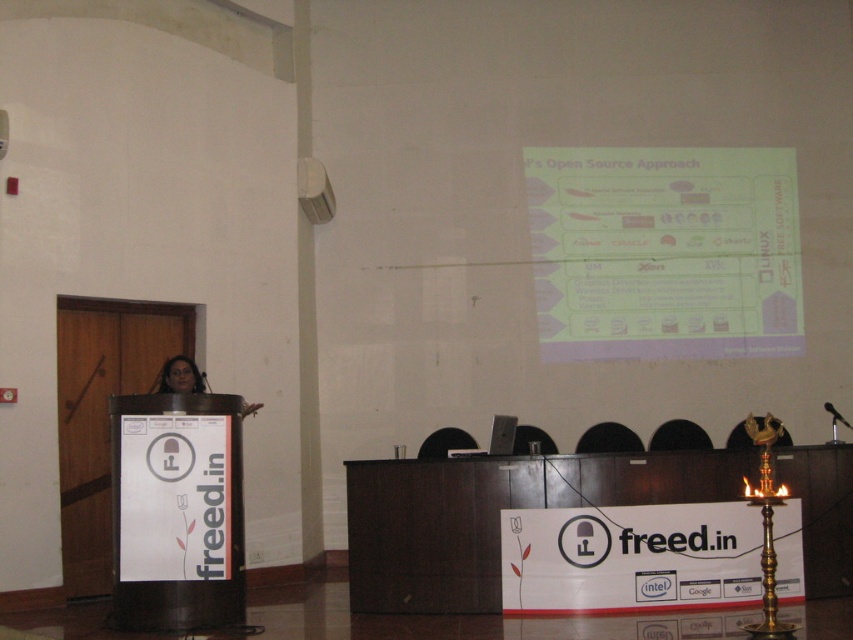
You are at the presentation and want to place a sticky note on the white paper at upper center located at point (x=664, y=252). Is this point within the area of the screen displaying the slide titled Open Source Approach?

The white paper at upper center is located at point (x=664, y=252), which is within the area of the screen displaying the slide titled Open Source Approach.

You are an attendee at the presentation. You notice the white paper at upper center and the matte black woman at center. Which object is positioned higher in the image?

The white paper at upper center is positioned higher than the matte black woman at center.

You are an attendee at the presentation and want to hand the presenter a note. You have a white paper at upper center and a matte black woman at center in your view. Which object is closer to the presenter?

The matte black woman at center is closer to the presenter because the white paper at upper center is to the right of the matte black woman at center, implying spatial positioning relative to the presenter.